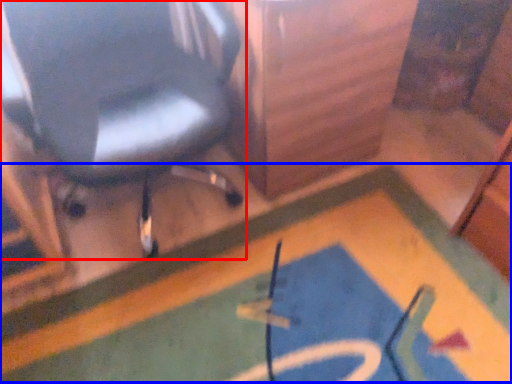
Question: Among these objects, which one is farthest to the camera, chair (highlighted by a red box) or bath mat (highlighted by a blue box)?

Choices:
 (A) chair
 (B) bath mat

Answer: (B)